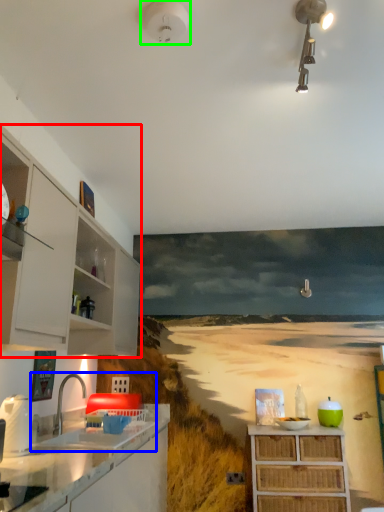
Question: Which object is positioned closest to cabinetry (highlighted by a red box)? Select from sink (highlighted by a blue box) and light fixture (highlighted by a green box).

Choices:
 (A) sink
 (B) light fixture

Answer: (A)